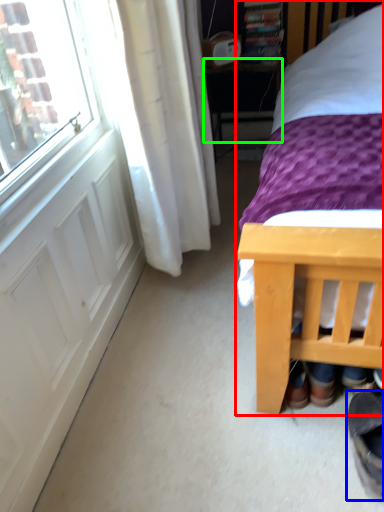
Question: Which object is the farthest from bed (highlighted by a red box)? Choose among these: footwear (highlighted by a blue box) or table (highlighted by a green box).

Choices:
 (A) footwear
 (B) table

Answer: (B)